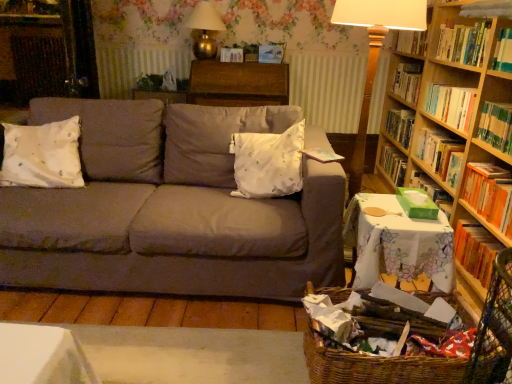
What is the approximate width of hardcover book at center, the 2th paperback book when ordered from right to left?

4.83 inches.

Measure the distance between point (389, 364) and camera.

Point (389, 364) and camera are 4.45 feet apart.

The width and height of the screenshot is (512, 384). What do you see at coordinates (496, 126) in the screenshot? I see `hardcover book at right, positioned as the 2th book in top-to-bottom order` at bounding box center [496, 126].

How much space does white satin pillow at left, placed as the 1th pillow when sorted from left to right, occupy vertically?

white satin pillow at left, placed as the 1th pillow when sorted from left to right, is 13.78 inches in height.

What do you see at coordinates (476, 249) in the screenshot? I see `hardcover book at right, which is counted as the 4th book, starting from the top` at bounding box center [476, 249].

Find the location of a particular element. wooden table lamp at right, the first table lamp from the right is located at coordinates (375, 53).

Locate an element on the screen. Image resolution: width=512 pixels, height=384 pixels. the 4th book counting from the right side of the hardcover book at center, which ranks as the 1th paperback book in left-to-right order is located at coordinates pos(450,105).

Which of these two, hardcover book at right, marked as the first book in a top-to-bottom arrangement, or hardcover book at center, the 2th paperback book when ordered from right to left, is smaller?

With smaller size is hardcover book at center, the 2th paperback book when ordered from right to left.

Looking at this image, from a real-world perspective, is hardcover book at right, the 4th book ordered from the bottom, physically above hardcover book at center, which ranks as the 1th paperback book in left-to-right order?

Actually, hardcover book at right, the 4th book ordered from the bottom, is physically below hardcover book at center, which ranks as the 1th paperback book in left-to-right order, in the real world.

Consider the image. Would you say white satin pillow at left, the second pillow from the right, is inside or outside white floral tablecloth at lower right, the first table from the front?

white satin pillow at left, the second pillow from the right, is located beyond the bounds of white floral tablecloth at lower right, the first table from the front.

Image resolution: width=512 pixels, height=384 pixels. Find the location of `the 2nd table to the right of the white satin pillow at left, placed as the 1th pillow when sorted from left to right, counting from the anchor's position`. the 2nd table to the right of the white satin pillow at left, placed as the 1th pillow when sorted from left to right, counting from the anchor's position is located at coordinates (397, 243).

Is white satin pillow at left, the second pillow from the right, directly adjacent to white floral tablecloth at lower right, the second table positioned from the top?

No, white satin pillow at left, the second pillow from the right, is not next to white floral tablecloth at lower right, the second table positioned from the top.

Between white satin pillow at center, arranged as the second pillow when viewed from the left, and matte gray couch at center, which one has smaller width?

With smaller width is white satin pillow at center, arranged as the second pillow when viewed from the left.

Which is closer, (239,189) or (133,152)?

Point (239,189) is positioned closer to the camera compared to point (133,152).

Is white satin pillow at center, arranged as the second pillow when viewed from the left, looking in the opposite direction of matte gray couch at center?

Correct, white satin pillow at center, arranged as the second pillow when viewed from the left, is looking away from matte gray couch at center.

Is white satin pillow at center, arranged as the second pillow when viewed from the left, shorter than matte gray couch at center?

Indeed, white satin pillow at center, arranged as the second pillow when viewed from the left, has a lesser height compared to matte gray couch at center.

Which object is closer to the camera taking this photo, white satin pillow at center, arranged as the second pillow when viewed from the left, or woven brown basket at lower right?

woven brown basket at lower right is in front.

In terms of width, does white satin pillow at center, arranged as the second pillow when viewed from the left, look wider or thinner when compared to woven brown basket at lower right?

Clearly, white satin pillow at center, arranged as the second pillow when viewed from the left, has less width compared to woven brown basket at lower right.

Looking at this image, from a real-world perspective, relative to woven brown basket at lower right, is white satin pillow at center, which appears as the 1th pillow when viewed from the right, vertically above or below?

From a real-world perspective, white satin pillow at center, which appears as the 1th pillow when viewed from the right, is physically above woven brown basket at lower right.

Consider the image. Between white satin pillow at center, which appears as the 1th pillow when viewed from the right, and woven brown basket at lower right, which one appears on the right side from the viewer's perspective?

woven brown basket at lower right is more to the right.

Is matte gray couch at center facing towards hardwood bookshelf at upper right?

No, matte gray couch at center is not oriented towards hardwood bookshelf at upper right.

Which point is more distant from viewer, (177, 137) or (501, 58)?

The point (177, 137) is behind.

Visually, is matte gray couch at center positioned to the left or to the right of hardwood bookshelf at upper right?

matte gray couch at center is to the left of hardwood bookshelf at upper right.

In the image, there is a hardwood bookshelf at upper right. Identify the location of studio couch below it (from the image's perspective). This screenshot has height=384, width=512. (170, 209).

From the image's perspective, which is below, orange hardcover book at right, which is the 3th book from top to bottom, or woven brown basket at lower right?

From the image's view, woven brown basket at lower right is below.

Can you tell me how much orange hardcover book at right, which is the 3th book from top to bottom, and woven brown basket at lower right differ in facing direction?

The facing directions of orange hardcover book at right, which is the 3th book from top to bottom, and woven brown basket at lower right are 2.08 degrees apart.

From a real-world perspective, is orange hardcover book at right, which is the 3th book from top to bottom, under woven brown basket at lower right?

No.

Considering the positions of point (483, 203) and point (315, 290), is point (483, 203) closer or farther from the camera than point (315, 290)?

Point (483, 203).

From the picture: Is metallic gold table lamp at upper center, arranged as the 2th table lamp when ordered from the bottom, placed right next to white satin pillow at left, the second pillow from the right?

metallic gold table lamp at upper center, arranged as the 2th table lamp when ordered from the bottom, and white satin pillow at left, the second pillow from the right, are clearly separated.

Is metallic gold table lamp at upper center, acting as the first table lamp starting from the left, at the left side of white satin pillow at left, placed as the 1th pillow when sorted from left to right?

No.

Which point is more distant from viewer, (209,24) or (74,159)?

The point (209,24) is farther from the camera.

Which pillow is the 1st one when counting from the front of the metallic gold table lamp at upper center, which is the second table lamp in front-to-back order? Please provide its 2D coordinates.

[(42, 155)]

From the image's perspective, starting from the hardcover book at right, marked as the first book in a top-to-bottom arrangement, which paperback book is the 1st one above? Please provide its 2D coordinates.

[(232, 55)]

From a real-world perspective, starting from the white floral tablecloth at lower right, positioned as the second table in back-to-front order, which pillow is the 2nd one vertically above it? Please provide its 2D coordinates.

[(42, 155)]

Considering their positions, is metallic gold table lamp at upper center, which ranks as the first table lamp in back-to-front order, positioned further to hardcover book at right, marked as the first book in a top-to-bottom arrangement, than wooden bookcase at right?

metallic gold table lamp at upper center, which ranks as the first table lamp in back-to-front order, is positioned further to the anchor hardcover book at right, marked as the first book in a top-to-bottom arrangement.

When comparing their distances from matte gray couch at center, does white floral tablecloth at lower right, positioned as the second table in back-to-front order, or white satin pillow at center, which appears as the 1th pillow when viewed from the right, seem closer?

Based on the image, white satin pillow at center, which appears as the 1th pillow when viewed from the right, appears to be nearer to matte gray couch at center.

From the image, which object appears to be farther from hardcover book at right, the 4th book ordered from the bottom, metallic gold table lamp at upper center, which is the second table lamp in front-to-back order, or wooden table at center, which ranks as the first table in back-to-front order?

metallic gold table lamp at upper center, which is the second table lamp in front-to-back order, is positioned further to the anchor hardcover book at right, the 4th book ordered from the bottom.

Looking at the image, which one is located closer to white floral tablecloth at lower right, acting as the first table starting from the right, white satin pillow at center, arranged as the second pillow when viewed from the left, or hardcover book at right, which ranks as the first book in bottom-to-top order?

hardcover book at right, which ranks as the first book in bottom-to-top order, is positioned closer to the anchor white floral tablecloth at lower right, acting as the first table starting from the right.

When comparing their distances from hardcover book at right, which is counted as the 4th book, starting from the top, does wooden table at center, placed as the first table when sorted from top to bottom, or hardcover book at right, the 4th book ordered from the bottom, seem closer?

Based on the image, hardcover book at right, the 4th book ordered from the bottom, appears to be nearer to hardcover book at right, which is counted as the 4th book, starting from the top.

Based on their spatial positions, is white floral tablecloth at lower right, the 1th table in the bottom-to-top sequence, or hardcover book at center, the 2th paperback book when ordered from right to left, further from hardcover book at right, which is counted as the 4th book, starting from the top?

hardcover book at center, the 2th paperback book when ordered from right to left, lies further to hardcover book at right, which is counted as the 4th book, starting from the top, than the other object.

Estimate the real-world distances between objects in this image. Which object is closer to white satin pillow at center, which appears as the 1th pillow when viewed from the right, wooden table lamp at right, arranged as the first table lamp when ordered from the bottom, or orange hardcover book at right, which is the 3th book from top to bottom?

Based on the image, wooden table lamp at right, arranged as the first table lamp when ordered from the bottom, appears to be nearer to white satin pillow at center, which appears as the 1th pillow when viewed from the right.

Estimate the real-world distances between objects in this image. Which object is closer to hardwood bookshelf at upper right, orange hardcover book at right, the 2th book when ordered from bottom to top, or matte plastic paperback book at upper center, which is counted as the 1th paperback book, starting from the right?

orange hardcover book at right, the 2th book when ordered from bottom to top.

I want to click on pillow between matte gray couch at center and wooden table lamp at right, the second table lamp positioned from the back, so click(x=268, y=163).

Where is `table positioned between hardcover book at right, the third book ordered from the bottom, and hardcover book at center, the 2th paperback book when ordered from right to left, from near to far`? The width and height of the screenshot is (512, 384). table positioned between hardcover book at right, the third book ordered from the bottom, and hardcover book at center, the 2th paperback book when ordered from right to left, from near to far is located at coordinates (238, 84).

Identify the location of paperback book between wooden table lamp at right, arranged as the 2th table lamp when viewed from the top, and hardcover book at center, the 2th paperback book when ordered from right to left, in the front-back direction. (271, 53).

Locate an element on the screen. table lamp between metallic gold table lamp at upper center, which is counted as the first table lamp, starting from the top, and orange hardcover book at right, the 2th book when ordered from bottom to top, in the horizontal direction is located at coordinates (375, 53).